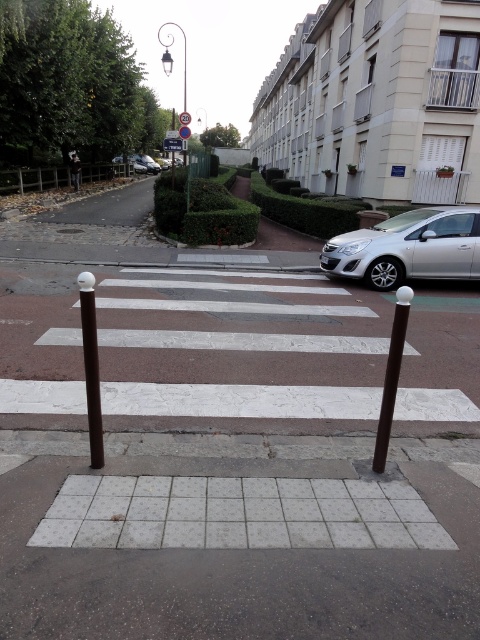
Question: Which object appears closest to the camera in this image?

Choices:
 (A) brown polished pole at lower right
 (B) silver metallic car at right
 (C) brown matte pole at center

Answer: (C)

Question: Does brown metal bollards at center have a greater width compared to brown matte pole at center?

Choices:
 (A) yes
 (B) no

Answer: (A)

Question: Does silver metallic car at right come behind brown polished pole at lower right?

Choices:
 (A) yes
 (B) no

Answer: (A)

Question: Which point is closer to the camera?

Choices:
 (A) brown matte pole at center
 (B) brown metal bollards at center

Answer: (A)

Question: Does silver metallic car at right have a lesser width compared to brown matte pole at center?

Choices:
 (A) no
 (B) yes

Answer: (A)

Question: Which point is closer to the camera taking this photo?

Choices:
 (A) (120, 369)
 (B) (402, 298)

Answer: (A)